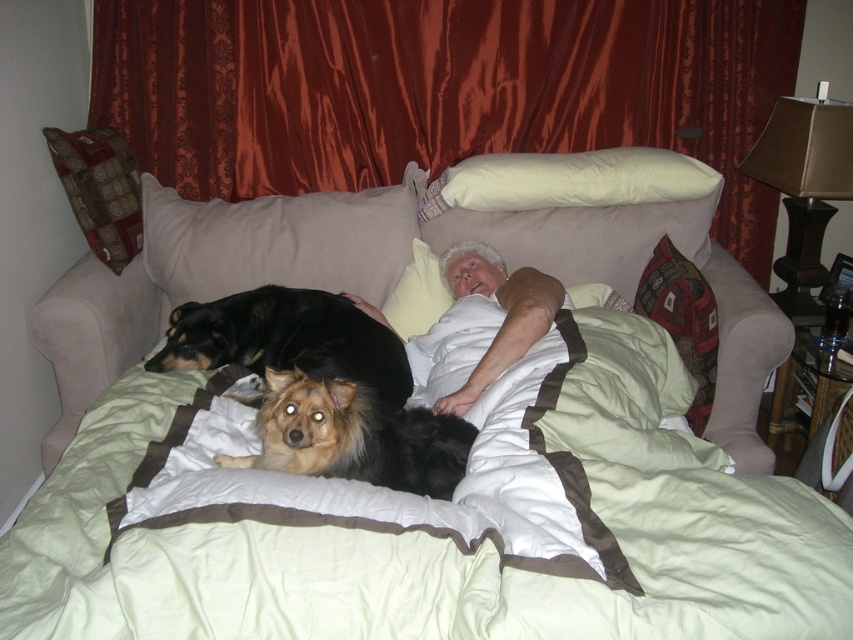
You are a photographer setting up for a family portrait. You have a camera with a lens that can focus on objects within 30 centimeters. You notice the silky red curtain at upper center and the white soft pillow at upper center in the frame. Can your camera focus on both objects at the same time?

The silky red curtain at upper center is 40.54 centimeters away from the white soft pillow at upper center. Since the camera lens can only focus within 30 centimeters, it cannot focus on both objects simultaneously because they are more than 30 centimeters apart.

In this indoor scene, there is a silky red curtain at upper center and a shiny black dog at center. From the perspective of someone looking at the image, which object is positioned to the right of the other?

The silky red curtain at upper center is to the right of the shiny black dog at center.